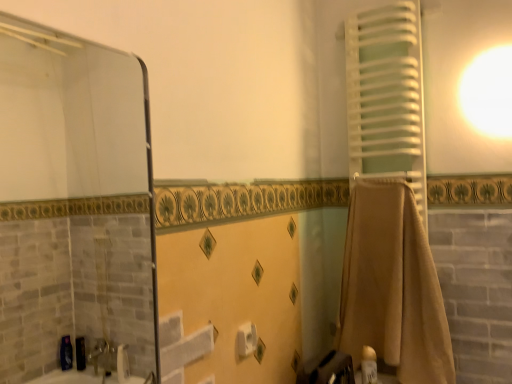
Question: Is white glossy lotion at lower right wider than white matte towel at right?

Choices:
 (A) no
 (B) yes

Answer: (A)

Question: Does white glossy lotion at lower right have a greater height compared to white matte towel at right?

Choices:
 (A) yes
 (B) no

Answer: (B)

Question: Does white glossy lotion at lower right appear on the left side of white matte towel at right?

Choices:
 (A) no
 (B) yes

Answer: (B)

Question: Is white glossy lotion at lower right touching white matte towel at right?

Choices:
 (A) no
 (B) yes

Answer: (A)

Question: Does white glossy lotion at lower right have a smaller size compared to white matte towel at right?

Choices:
 (A) yes
 (B) no

Answer: (A)

Question: From a real-world perspective, is white glossy lotion at lower right positioned above or below transparent glass mirror at upper left?

Choices:
 (A) above
 (B) below

Answer: (B)

Question: Is white glossy lotion at lower right taller or shorter than transparent glass mirror at upper left?

Choices:
 (A) short
 (B) tall

Answer: (A)

Question: Considering the positions of white glossy lotion at lower right and transparent glass mirror at upper left in the image, is white glossy lotion at lower right bigger or smaller than transparent glass mirror at upper left?

Choices:
 (A) small
 (B) big

Answer: (A)

Question: From the image's perspective, is white glossy lotion at lower right located above or below transparent glass mirror at upper left?

Choices:
 (A) above
 (B) below

Answer: (B)

Question: Is white matte towel at right in front of or behind white matte toilet paper at center in the image?

Choices:
 (A) front
 (B) behind

Answer: (B)

Question: From their relative heights in the image, would you say white matte towel at right is taller or shorter than white matte toilet paper at center?

Choices:
 (A) tall
 (B) short

Answer: (A)

Question: Considering the positions of white matte towel at right and white matte toilet paper at center in the image, is white matte towel at right wider or thinner than white matte toilet paper at center?

Choices:
 (A) wide
 (B) thin

Answer: (A)

Question: From a real-world perspective, is white matte towel at right above or below white matte toilet paper at center?

Choices:
 (A) below
 (B) above

Answer: (B)

Question: Based on their sizes in the image, would you say transparent glass mirror at upper left is bigger or smaller than white matte towel at right?

Choices:
 (A) small
 (B) big

Answer: (A)

Question: Would you say transparent glass mirror at upper left is to the left or to the right of white matte towel at right in the picture?

Choices:
 (A) right
 (B) left

Answer: (B)